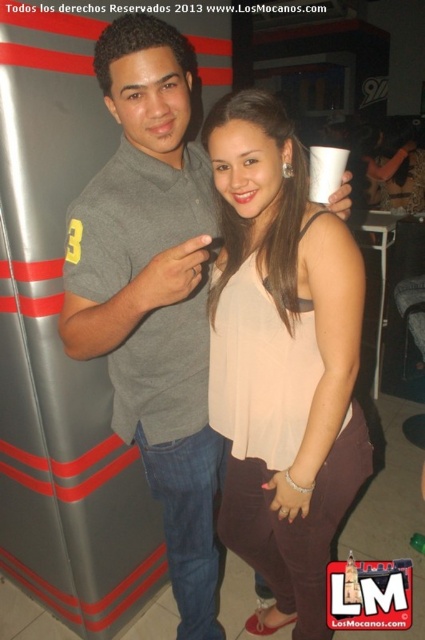
Question: Estimate the real-world distances between objects in this image. Which object is closer to the matte beige blouse at center?

Choices:
 (A) gray cotton polo shirt at center
 (B) white paper cup at center

Answer: (A)

Question: From the image, what is the correct spatial relationship of matte beige blouse at center in relation to gray cotton polo shirt at center?

Choices:
 (A) right
 (B) left

Answer: (A)

Question: Based on their relative distances, which object is farther from the gray cotton polo shirt at center?

Choices:
 (A) matte beige blouse at center
 (B) white paper cup at center

Answer: (B)

Question: Is matte beige blouse at center to the left of white paper cup at center from the viewer's perspective?

Choices:
 (A) yes
 (B) no

Answer: (A)

Question: Can you confirm if gray cotton polo shirt at center is thinner than white paper cup at center?

Choices:
 (A) yes
 (B) no

Answer: (B)

Question: Which object is farther from the camera taking this photo?

Choices:
 (A) white paper cup at center
 (B) gray cotton polo shirt at center
 (C) matte beige blouse at center

Answer: (A)